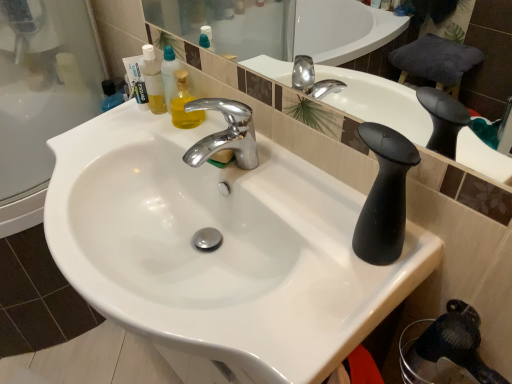
Question: From the image's perspective, is translucent plastic mouthwash at upper left located above or below white matte toothpaste tube at upper left?

Choices:
 (A) below
 (B) above

Answer: (B)

Question: Considering the positions of translucent plastic mouthwash at upper left and white matte toothpaste tube at upper left in the image, is translucent plastic mouthwash at upper left bigger or smaller than white matte toothpaste tube at upper left?

Choices:
 (A) big
 (B) small

Answer: (A)

Question: Based on their relative distances, which object is farther from the white glossy sink at center?

Choices:
 (A) white matte toothpaste tube at upper left
 (B) translucent plastic mouthwash at upper left

Answer: (A)

Question: Based on their relative distances, which object is nearer to the white glossy sink at center?

Choices:
 (A) white matte toothpaste tube at upper left
 (B) translucent plastic mouthwash at upper left

Answer: (B)